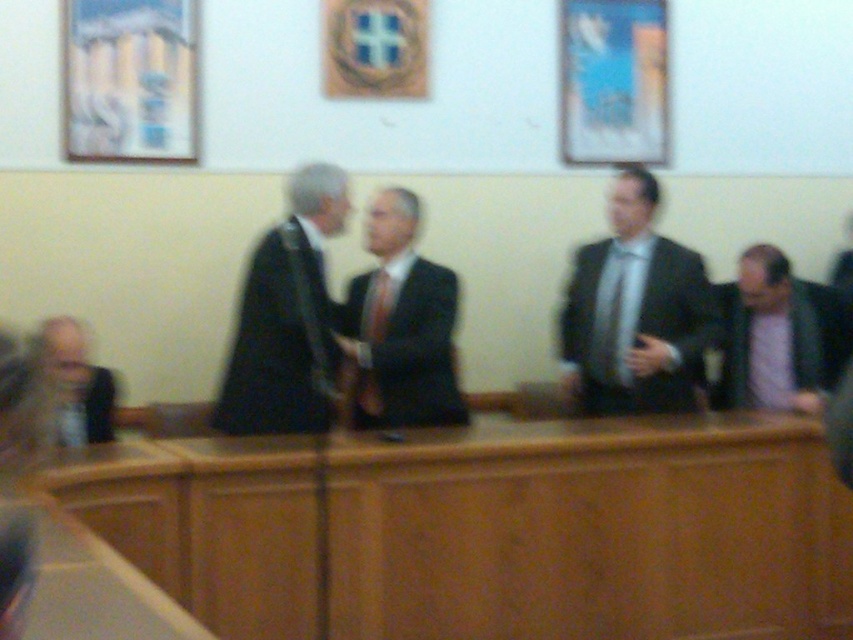
Is matte black suit at center below pink fabric shirt at lower right?

No, matte black suit at center is not below pink fabric shirt at lower right.

Does point (392, 243) lie in front of point (755, 348)?

Yes.

The width and height of the screenshot is (853, 640). I want to click on matte black suit at center, so click(x=399, y=326).

Who is more forward, (695, 376) or (757, 353)?

Point (695, 376) is more forward.

This screenshot has height=640, width=853. What do you see at coordinates (635, 310) in the screenshot? I see `matte black suit at right` at bounding box center [635, 310].

Does point (579, 342) lie behind point (740, 388)?

No.

Find the location of a particular element. The width and height of the screenshot is (853, 640). matte black suit at right is located at coordinates (635, 310).

The width and height of the screenshot is (853, 640). Find the location of `black matte suit at center`. black matte suit at center is located at coordinates (287, 317).

Is point (218, 417) positioned after point (386, 333)?

No, (218, 417) is closer to viewer.

Where is `black matte suit at center`? The height and width of the screenshot is (640, 853). black matte suit at center is located at coordinates (287, 317).